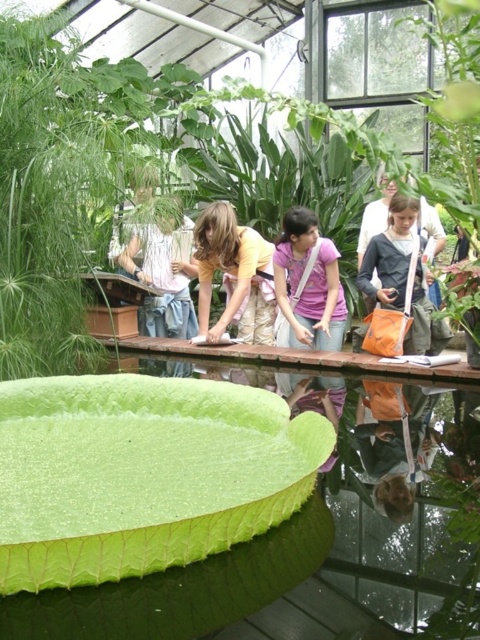
Question: Which object is closer to the camera taking this photo?

Choices:
 (A) pink fabric shirt at center
 (B) orange fabric bag at center-right
 (C) yellow matte shirt at center
 (D) white cotton shirt at center

Answer: (B)

Question: Does yellow matte shirt at center have a smaller size compared to white cotton shirt at center?

Choices:
 (A) no
 (B) yes

Answer: (A)

Question: Which point is farther to the camera?

Choices:
 (A) white cotton shirt at center
 (B) green leafy pond at lower left
 (C) pink fabric shirt at center
 (D) yellow matte shirt at center

Answer: (A)

Question: Is green leafy pond at lower left to the right of orange fabric bag at center-right from the viewer's perspective?

Choices:
 (A) no
 (B) yes

Answer: (A)

Question: Does yellow matte shirt at center come in front of white cotton shirt at center?

Choices:
 (A) no
 (B) yes

Answer: (B)

Question: Which of the following is the closest to the observer?

Choices:
 (A) pink fabric shirt at center
 (B) yellow matte shirt at center
 (C) orange fabric bag at center-right

Answer: (C)